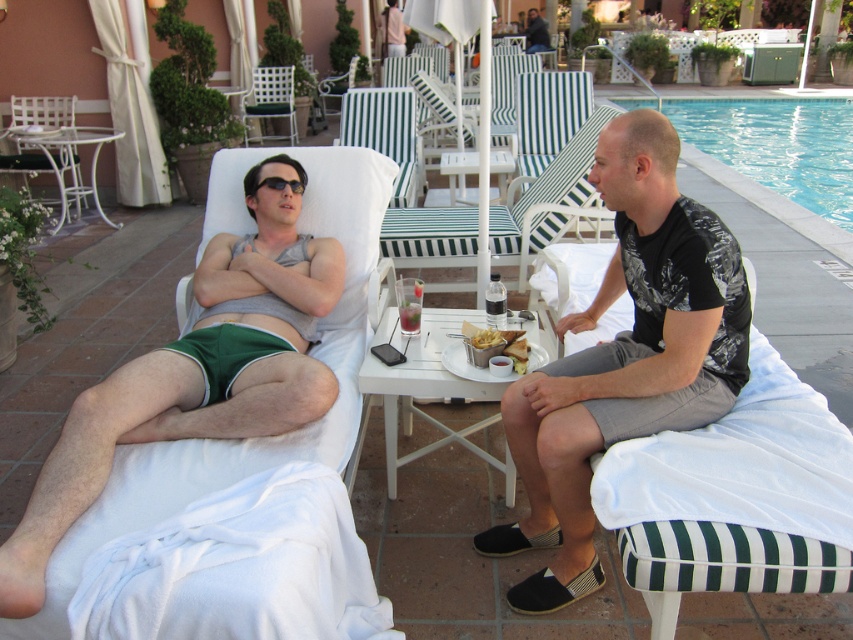
Question: Among these points, which one is nearest to the camera?

Choices:
 (A) (410, 307)
 (B) (260, 182)

Answer: (A)

Question: Can you confirm if matte gray tank top at center is positioned below green striped lounge chair at center?

Choices:
 (A) no
 (B) yes

Answer: (B)

Question: Which object is the farthest from the black printed t-shirt at right?

Choices:
 (A) green cotton shorts at left
 (B) golden crispy fries at center
 (C) white wicker chair at upper center
 (D) black plastic sunglasses at upper center

Answer: (C)

Question: Which of the following is the farthest from the observer?

Choices:
 (A) (503, 307)
 (B) (270, 74)
 (C) (402, 122)
 (D) (525, 356)

Answer: (B)

Question: Considering the relative positions of green striped lounge chair at center and black plastic sunglasses at upper center in the image provided, where is green striped lounge chair at center located with respect to black plastic sunglasses at upper center?

Choices:
 (A) right
 (B) left

Answer: (B)

Question: Considering the relative positions of white metal chair at upper left and golden crispy fries at center in the image provided, where is white metal chair at upper left located with respect to golden crispy fries at center?

Choices:
 (A) left
 (B) right

Answer: (A)